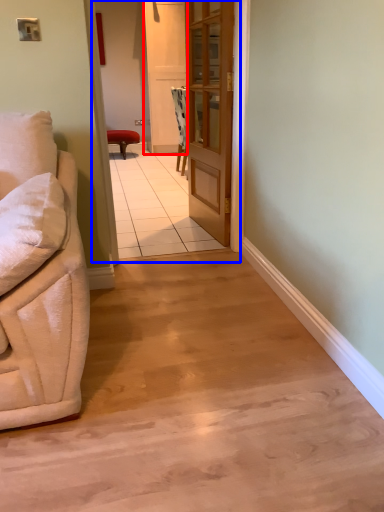
Question: Which object appears farthest to the camera in this image, screen door (highlighted by a red box) or corridor (highlighted by a blue box)?

Choices:
 (A) screen door
 (B) corridor

Answer: (A)